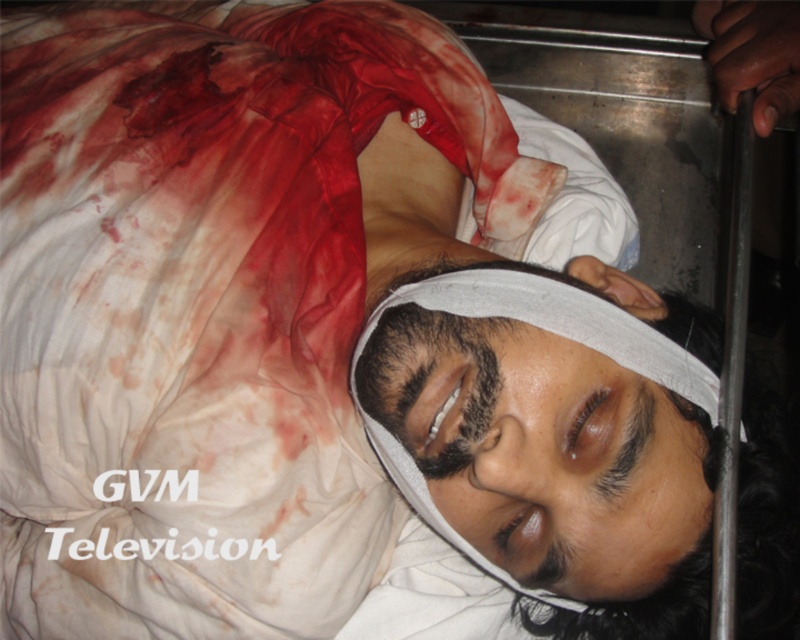
Which is above, white bandage at center or dry skin forehead at center?

dry skin forehead at center is above.

Does point (580, 323) come in front of point (394, 348)?

Yes, it is in front of point (394, 348).

The height and width of the screenshot is (640, 800). I want to click on white bandage at center, so click(x=544, y=330).